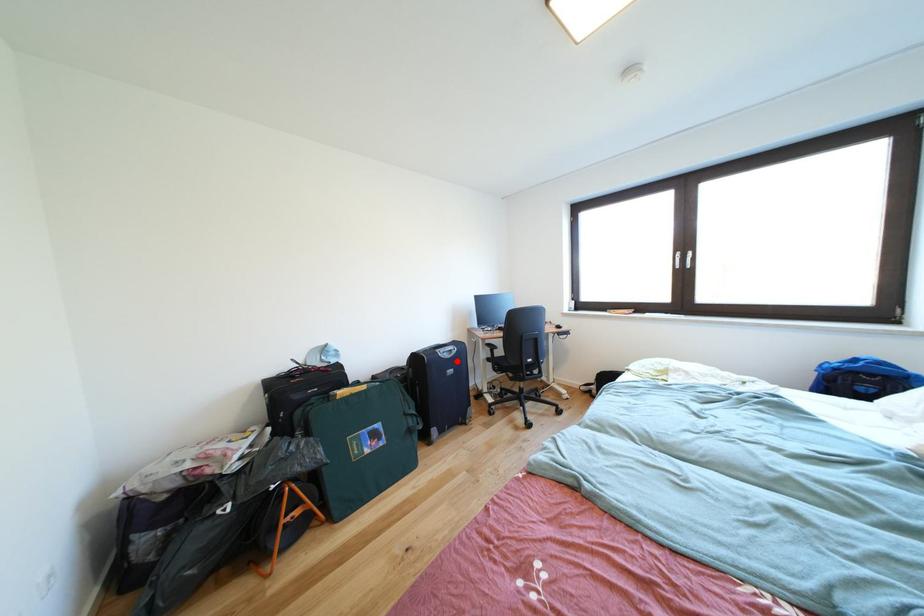
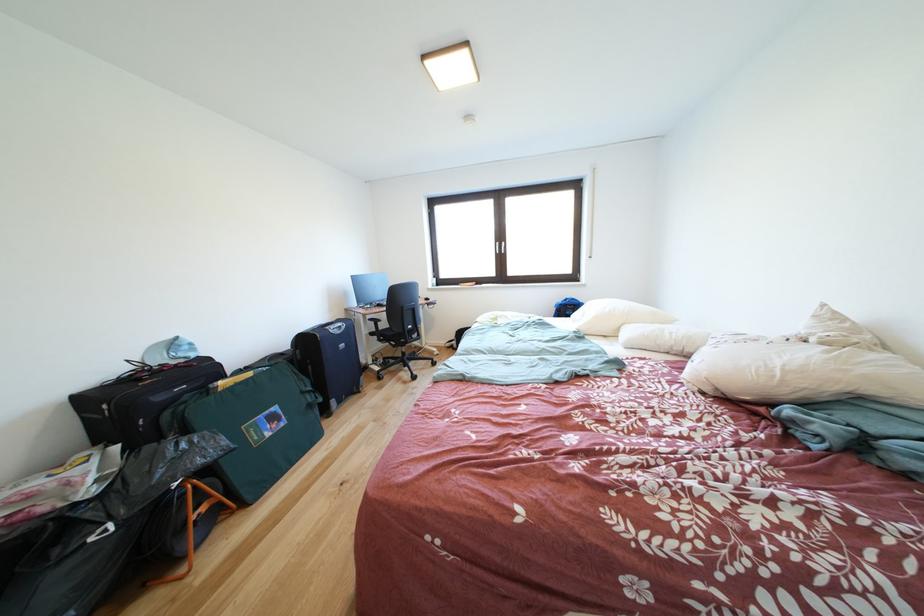
Question: I am providing you with two images of the same scene from different viewpoints. Given a red point in image1, look at the same physical point in image2. Is it:

Choices:
 (A) Closer to the viewpoint
 (B) Farther from the viewpoint

Answer: (A)